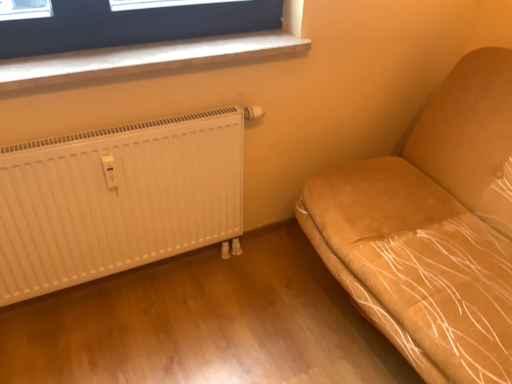
Question: Is white plastic window sill at upper left to the right of suede-like tan sofa at right from the viewer's perspective?

Choices:
 (A) yes
 (B) no

Answer: (B)

Question: Can you confirm if white plastic window sill at upper left is shorter than suede-like tan sofa at right?

Choices:
 (A) no
 (B) yes

Answer: (B)

Question: From a real-world perspective, is white plastic window sill at upper left under suede-like tan sofa at right?

Choices:
 (A) yes
 (B) no

Answer: (B)

Question: Is suede-like tan sofa at right at the back of white plastic window sill at upper left?

Choices:
 (A) no
 (B) yes

Answer: (A)

Question: From a real-world perspective, is white plastic window sill at upper left positioned over suede-like tan sofa at right based on gravity?

Choices:
 (A) no
 (B) yes

Answer: (B)

Question: Is white plastic window sill at upper left in front of or behind white ribbed radiator at lower left in the image?

Choices:
 (A) behind
 (B) front

Answer: (A)

Question: From the image's perspective, is white plastic window sill at upper left positioned above or below white ribbed radiator at lower left?

Choices:
 (A) below
 (B) above

Answer: (B)

Question: Based on their sizes in the image, would you say white plastic window sill at upper left is bigger or smaller than white ribbed radiator at lower left?

Choices:
 (A) small
 (B) big

Answer: (A)

Question: Visually, is white plastic window sill at upper left positioned to the left or to the right of white ribbed radiator at lower left?

Choices:
 (A) left
 (B) right

Answer: (B)

Question: From a real-world perspective, is suede-like tan sofa at right physically located above or below white plastic window sill at upper left?

Choices:
 (A) below
 (B) above

Answer: (A)

Question: Looking at their shapes, would you say suede-like tan sofa at right is wider or thinner than white plastic window sill at upper left?

Choices:
 (A) wide
 (B) thin

Answer: (A)

Question: Considering the relative positions of suede-like tan sofa at right and white plastic window sill at upper left in the image provided, is suede-like tan sofa at right to the left or to the right of white plastic window sill at upper left?

Choices:
 (A) right
 (B) left

Answer: (A)

Question: From their relative heights in the image, would you say suede-like tan sofa at right is taller or shorter than white plastic window sill at upper left?

Choices:
 (A) short
 (B) tall

Answer: (B)

Question: From their relative heights in the image, would you say white plastic window sill at upper left is taller or shorter than suede-like tan sofa at right?

Choices:
 (A) tall
 (B) short

Answer: (B)

Question: From the image's perspective, relative to suede-like tan sofa at right, is white plastic window sill at upper left above or below?

Choices:
 (A) above
 (B) below

Answer: (A)